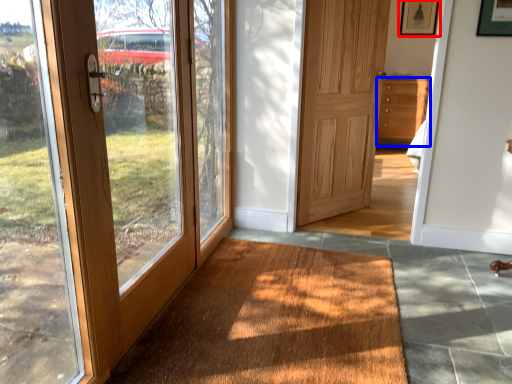
Question: Which of the following is the farthest to the observer, picture frame (highlighted by a red box) or chest of drawers (highlighted by a blue box)?

Choices:
 (A) picture frame
 (B) chest of drawers

Answer: (A)